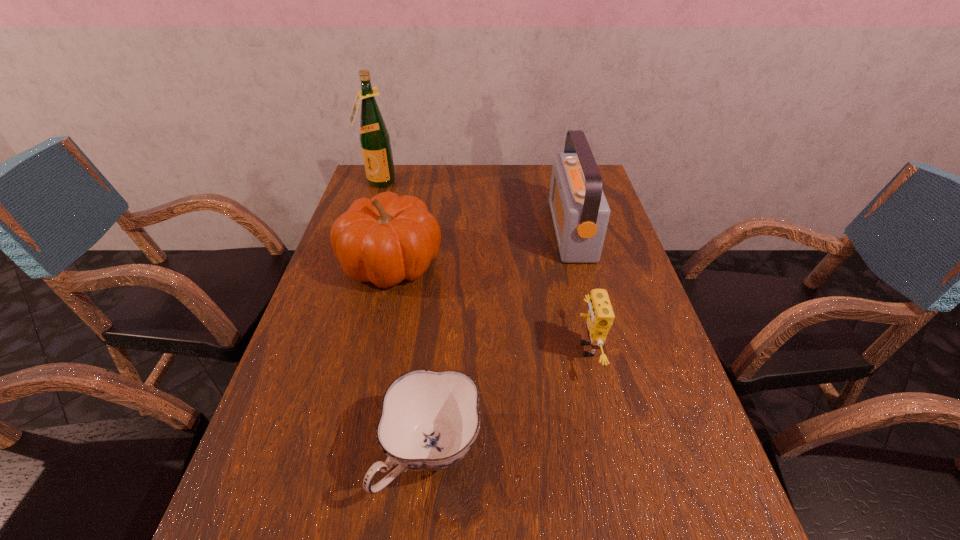
Where is `vacant space positioned 0.300m on the front-facing side of the radio receiver`? This screenshot has width=960, height=540. vacant space positioned 0.300m on the front-facing side of the radio receiver is located at coordinates (456, 231).

Image resolution: width=960 pixels, height=540 pixels. What are the coordinates of `vacant area situated 0.100m on the front-facing side of the radio receiver` in the screenshot? It's located at (x=521, y=231).

Identify the location of vacant space located 0.160m on the front of the third shortest object. This screenshot has height=540, width=960. (371, 348).

Image resolution: width=960 pixels, height=540 pixels. Find the location of `free spot located 0.110m on the face of the second nearest object`. free spot located 0.110m on the face of the second nearest object is located at coordinates (525, 349).

At what (x,y) coordinates should I click in order to perform the action: click on free space located 0.230m on the face of the second nearest object. Please return your answer as a coordinate pair (x, y). Looking at the image, I should click on (472, 349).

This screenshot has width=960, height=540. In order to click on vacant space located on the face of the second nearest object in this screenshot , I will do `click(542, 349)`.

The height and width of the screenshot is (540, 960). Find the location of `free spot located on the back of the chinaware`. free spot located on the back of the chinaware is located at coordinates (437, 377).

Image resolution: width=960 pixels, height=540 pixels. In order to click on object situated at the far edge in this screenshot , I will do `click(374, 137)`.

This screenshot has height=540, width=960. I want to click on liquor that is at the left edge, so click(374, 137).

This screenshot has height=540, width=960. What are the coordinates of `pumpkin that is at the left edge` in the screenshot? It's located at (384, 240).